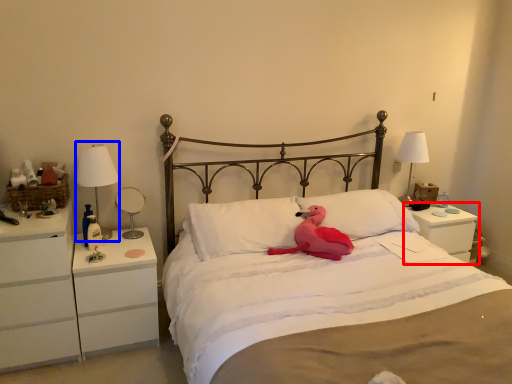
Question: Which of the following is the closest to the observer, nightstand (highlighted by a red box) or bedside lamp (highlighted by a blue box)?

Choices:
 (A) nightstand
 (B) bedside lamp

Answer: (B)